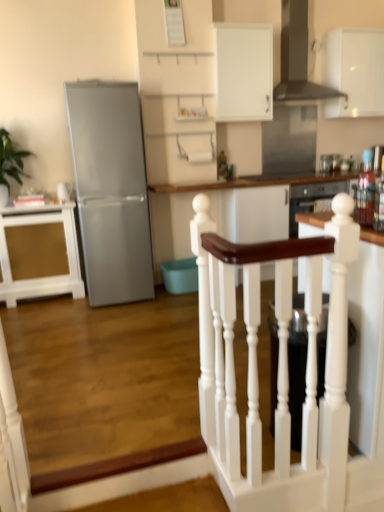
Where is `white matte cabinet at upper right, arranged as the third cabinetry when ordered from the bottom`? This screenshot has height=512, width=384. white matte cabinet at upper right, arranged as the third cabinetry when ordered from the bottom is located at coordinates (354, 71).

How much space does white matte cabinet at upper right, placed as the first cabinetry when sorted from right to left, occupy vertically?

It is 31.41 inches.

What do you see at coordinates (297, 57) in the screenshot? I see `black matte exhaust hood at upper center` at bounding box center [297, 57].

You are a GUI agent. You are given a task and a screenshot of the screen. Output one action in this format:
    pyautogui.click(x=<x>, y=<y>)
    Task: Click on the stainless steel glass door at upper center
    This screenshot has width=384, height=512.
    Given the screenshot: What is the action you would take?
    pyautogui.click(x=289, y=141)

This screenshot has height=512, width=384. Describe the element at coordinates (39, 253) in the screenshot. I see `gold textured cabinet at left, the 1th cabinetry from the left` at that location.

This screenshot has width=384, height=512. In order to click on white wood table at center in this screenshot , I will do `click(235, 210)`.

The image size is (384, 512). Identify the location of metallic stainless steel toaster at upper right, which ranks as the first appliance in top-to-bottom order. (330, 163).

Is green leafy plant at left positioned far away from satin silver refrigerator at left?

No, green leafy plant at left is in close proximity to satin silver refrigerator at left.

Is point (10, 148) farther from viewer compared to point (136, 89)?

Yes, point (10, 148) is farther from viewer.

From a real-world perspective, which object stands above the other?

green leafy plant at left.

Find the location of a particular element. The image size is (384, 512). plant that appears above the satin silver refrigerator at left (from a real-world perspective) is located at coordinates (11, 160).

From a real-world perspective, is green leafy plant at left under white matte cabinet at upper right, arranged as the third cabinetry when ordered from the bottom?

Yes.

Which of these two, green leafy plant at left or white matte cabinet at upper right, placed as the first cabinetry when sorted from top to bottom, is wider?

With larger width is green leafy plant at left.

In terms of size, does green leafy plant at left appear bigger or smaller than white matte cabinet at upper right, which ranks as the 3th cabinetry in left-to-right order?

Clearly, green leafy plant at left is smaller in size than white matte cabinet at upper right, which ranks as the 3th cabinetry in left-to-right order.

In the scene shown: Is green leafy plant at left facing away from white matte cabinet at upper right, which ranks as the 3th cabinetry in left-to-right order?

green leafy plant at left is not turned away from white matte cabinet at upper right, which ranks as the 3th cabinetry in left-to-right order.

Is metallic glass bottles at right, which is counted as the second appliance, starting from the top, inside the boundaries of white matte cabinet at upper center, which appears as the second cabinetry when ordered from the bottom, or outside?

metallic glass bottles at right, which is counted as the second appliance, starting from the top, is not enclosed by white matte cabinet at upper center, which appears as the second cabinetry when ordered from the bottom.

This screenshot has height=512, width=384. There is a white matte cabinet at upper center, marked as the 2th cabinetry in a top-to-bottom arrangement. Identify the location of the 2nd appliance below it (from the image's perspective). (365, 191).

Considering the relative positions of metallic glass bottles at right, the second appliance when ordered from right to left, and white matte cabinet at upper center, marked as the 2th cabinetry in a top-to-bottom arrangement, in the image provided, is metallic glass bottles at right, the second appliance when ordered from right to left, in front of white matte cabinet at upper center, marked as the 2th cabinetry in a top-to-bottom arrangement,?

That is True.

Is metallic glass bottles at right, the first appliance when ordered from left to right, facing towards white matte cabinet at upper center, which ranks as the second cabinetry in right-to-left order?

No, metallic glass bottles at right, the first appliance when ordered from left to right, is not oriented towards white matte cabinet at upper center, which ranks as the second cabinetry in right-to-left order.

How distant is green leafy plant at left from gold textured cabinet at left, which ranks as the 3th cabinetry in right-to-left order?

green leafy plant at left and gold textured cabinet at left, which ranks as the 3th cabinetry in right-to-left order, are 23.44 inches apart from each other.

Is green leafy plant at left completely or partially outside of gold textured cabinet at left, which ranks as the 3th cabinetry in right-to-left order?

Yes.

Identify the location of plant above the gold textured cabinet at left, the 1th cabinetry from the left (from the image's perspective). The width and height of the screenshot is (384, 512). (11, 160).

Who is shorter, green leafy plant at left or gold textured cabinet at left, which is the first cabinetry in bottom-to-top order?

green leafy plant at left is shorter.

Could you tell me if white painted wood handrail at center is turned towards satin silver refrigerator at left?

Yes, white painted wood handrail at center is aimed at satin silver refrigerator at left.

Does white painted wood handrail at center have a larger size compared to satin silver refrigerator at left?

Incorrect, white painted wood handrail at center is not larger than satin silver refrigerator at left.

Is white painted wood handrail at center taller than satin silver refrigerator at left?

Incorrect, the height of white painted wood handrail at center is not larger of that of satin silver refrigerator at left.

From the image's perspective, does white painted wood handrail at center appear lower than satin silver refrigerator at left?

Yes, from the image's perspective, white painted wood handrail at center is below satin silver refrigerator at left.

Which is more to the left, green leafy plant at left or white wood table at center?

Positioned to the left is green leafy plant at left.

Is green leafy plant at left taller than white wood table at center?

No, green leafy plant at left is not taller than white wood table at center.

Consider the image. Can you confirm if green leafy plant at left is wider than white wood table at center?

Incorrect, the width of green leafy plant at left does not surpass that of white wood table at center.

Where is `plant above the white wood table at center (from a real-world perspective)`? plant above the white wood table at center (from a real-world perspective) is located at coordinates (11, 160).

Considering the positions of points (341, 101) and (263, 165), is point (341, 101) closer to camera compared to point (263, 165)?

Yes, it is in front of point (263, 165).

Looking at this image, how different are the orientations of white matte cabinet at upper right, placed as the first cabinetry when sorted from top to bottom, and stainless steel glass door at upper center in degrees?

white matte cabinet at upper right, placed as the first cabinetry when sorted from top to bottom, and stainless steel glass door at upper center are facing 0.901 degrees away from each other.

From the image's perspective, is white matte cabinet at upper right, which ranks as the 3th cabinetry in left-to-right order, above or below stainless steel glass door at upper center?

Clearly, from the image's perspective, white matte cabinet at upper right, which ranks as the 3th cabinetry in left-to-right order, is above stainless steel glass door at upper center.

Is white matte cabinet at upper right, arranged as the third cabinetry when ordered from the bottom, taller or shorter than stainless steel glass door at upper center?

white matte cabinet at upper right, arranged as the third cabinetry when ordered from the bottom, is taller than stainless steel glass door at upper center.

You are a GUI agent. You are given a task and a screenshot of the screen. Output one action in this format:
    pyautogui.click(x=<x>, y=<y>)
    Task: Click on the refrigerator below the green leafy plant at left (from the image's perspective)
    The width and height of the screenshot is (384, 512).
    Given the screenshot: What is the action you would take?
    pyautogui.click(x=111, y=190)

The width and height of the screenshot is (384, 512). I want to click on the 2nd cabinetry above when counting from the green leafy plant at left (from the image's perspective), so click(354, 71).

From the picture: Based on their spatial positions, is white matte cabinet at upper center, which ranks as the second cabinetry in right-to-left order, or metallic glass bottles at right, marked as the second appliance in a back-to-front arrangement, closer to green leafy plant at left?

white matte cabinet at upper center, which ranks as the second cabinetry in right-to-left order, is closer to green leafy plant at left.

Based on their spatial positions, is green leafy plant at left or white painted wood handrail at center further from satin silver refrigerator at left?

white painted wood handrail at center lies further to satin silver refrigerator at left than the other object.

From the image, which object appears to be nearer to satin silver refrigerator at left, gold textured cabinet at left, the third cabinetry in the top-to-bottom sequence, or white painted wood handrail at center?

gold textured cabinet at left, the third cabinetry in the top-to-bottom sequence, lies closer to satin silver refrigerator at left than the other object.

From the image, which object appears to be nearer to metallic glass bottles at right, which is counted as the second appliance, starting from the top, white painted wood handrail at center or metallic stainless steel toaster at upper right, the 2th appliance in the left-to-right sequence?

metallic stainless steel toaster at upper right, the 2th appliance in the left-to-right sequence, is positioned closer to the anchor metallic glass bottles at right, which is counted as the second appliance, starting from the top.

Which object lies nearer to the anchor point metallic stainless steel toaster at upper right, which ranks as the first appliance in top-to-bottom order, black matte exhaust hood at upper center or metallic glass bottles at right, which is counted as the second appliance, starting from the top?

The object closer to metallic stainless steel toaster at upper right, which ranks as the first appliance in top-to-bottom order, is metallic glass bottles at right, which is counted as the second appliance, starting from the top.

Which object lies further to the anchor point white painted wood handrail at center, black matte exhaust hood at upper center or white matte cabinet at upper right, placed as the first cabinetry when sorted from right to left?

white matte cabinet at upper right, placed as the first cabinetry when sorted from right to left.

Considering their positions, is white wood table at center positioned closer to white matte cabinet at upper center, marked as the 2th cabinetry in a top-to-bottom arrangement, than metallic stainless steel toaster at upper right, placed as the first appliance when sorted from right to left?

The object closer to white matte cabinet at upper center, marked as the 2th cabinetry in a top-to-bottom arrangement, is white wood table at center.

When comparing their distances from gold textured cabinet at left, which is the first cabinetry in bottom-to-top order, does metallic glass bottles at right, the 1th appliance when ordered from front to back, or white painted wood handrail at center seem further?

metallic glass bottles at right, the 1th appliance when ordered from front to back, is positioned further to the anchor gold textured cabinet at left, which is the first cabinetry in bottom-to-top order.

Locate an element on the screen. This screenshot has height=512, width=384. refrigerator located between green leafy plant at left and stainless steel glass door at upper center in the left-right direction is located at coordinates (111, 190).

Locate an element on the screen. This screenshot has width=384, height=512. exhaust hood between metallic glass bottles at right, the 1th appliance when ordered from front to back, and white matte cabinet at upper center, positioned as the 2th cabinetry in left-to-right order, from front to back is located at coordinates (297, 57).

Locate an element on the screen. The image size is (384, 512). table situated between green leafy plant at left and black matte exhaust hood at upper center from left to right is located at coordinates (235, 210).

Identify the location of glass door between white painted wood handrail at center and white matte cabinet at upper right, arranged as the third cabinetry when ordered from the bottom, along the z-axis. (289, 141).